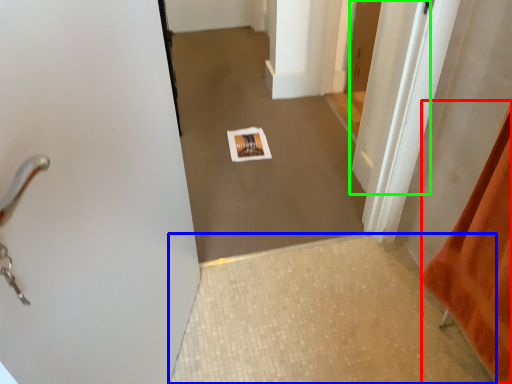
Question: Which is farther away from blanket (highlighted by a red box)? tile (highlighted by a blue box) or door (highlighted by a green box)?

Choices:
 (A) tile
 (B) door

Answer: (B)